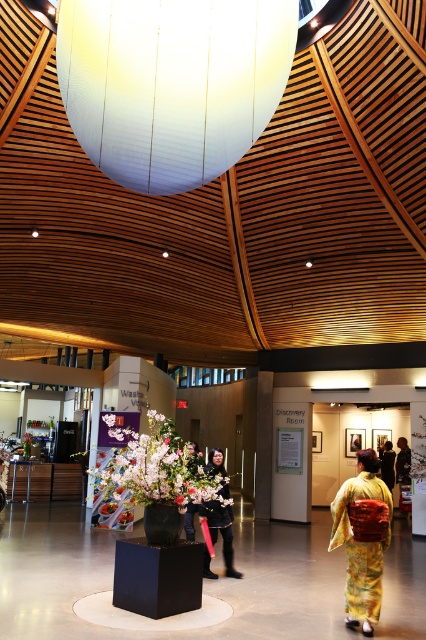
Question: Is floral arrangement at center wider than yellow silk kimono at center?

Choices:
 (A) yes
 (B) no

Answer: (A)

Question: Which object is the farthest from the black fabric jacket at center?

Choices:
 (A) yellow silk kimono at center
 (B) floral arrangement at center

Answer: (A)

Question: Does floral arrangement at center appear on the left side of silky kimono at center?

Choices:
 (A) no
 (B) yes

Answer: (B)

Question: Which point is closer to the camera taking this photo?

Choices:
 (A) click(x=195, y=472)
 (B) click(x=360, y=538)

Answer: (B)

Question: Which point is closer to the camera?

Choices:
 (A) (198, 461)
 (B) (339, 492)
 (C) (224, 534)

Answer: (B)

Question: Is yellow silk kimono at center below black fabric jacket at center?

Choices:
 (A) no
 (B) yes

Answer: (A)